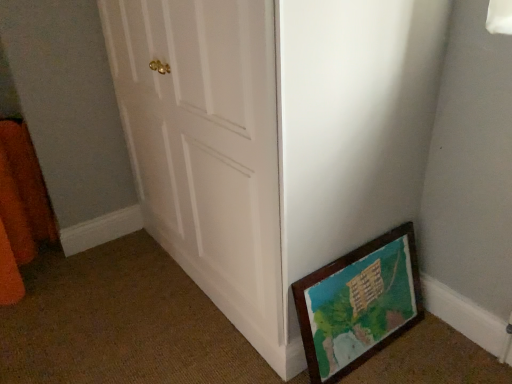
The width and height of the screenshot is (512, 384). What are the coordinates of `free location to the right of orange fuzzy curtain at left` in the screenshot? It's located at (114, 265).